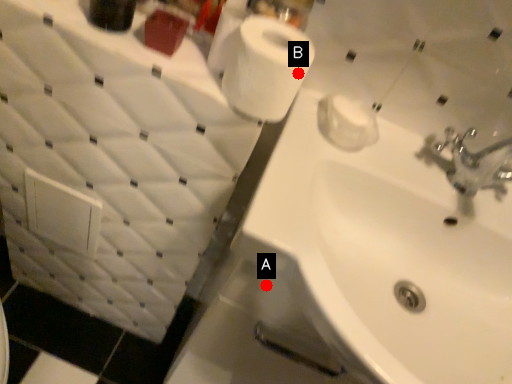
Question: Two points are circled on the image, labeled by A and B beside each circle. Which point is closer to the camera taking this photo?

Choices:
 (A) A is closer
 (B) B is closer

Answer: (B)